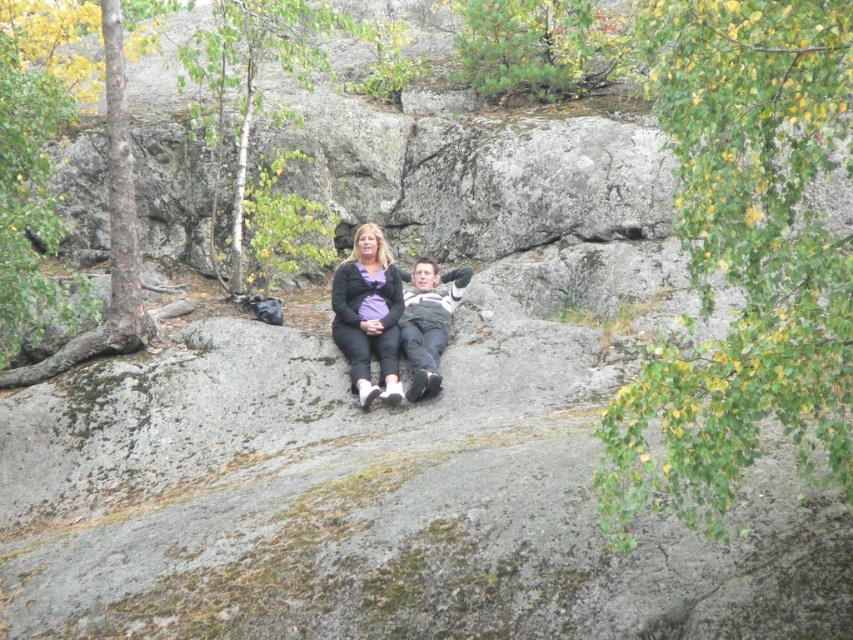
Question: Does green leafy tree at upper center have a smaller size compared to matte gray sweater at center?

Choices:
 (A) yes
 (B) no

Answer: (B)

Question: Among these objects, which one is farthest from the camera?

Choices:
 (A) green leafy branch at upper right
 (B) green rough bark tree at left
 (C) green leafy tree at upper center

Answer: (C)

Question: Estimate the real-world distances between objects in this image. Which object is closer to the matte gray sweater at center?

Choices:
 (A) matte black sweater at center
 (B) green leafy tree at upper center

Answer: (A)

Question: Does green leafy branch at upper right have a smaller size compared to green leafy tree at upper center?

Choices:
 (A) yes
 (B) no

Answer: (B)

Question: Does green leafy branch at upper right have a smaller size compared to matte black sweater at center?

Choices:
 (A) no
 (B) yes

Answer: (A)

Question: Estimate the real-world distances between objects in this image. Which object is farther from the green rough bark tree at left?

Choices:
 (A) matte gray sweater at center
 (B) green leafy tree at upper center
 (C) green leafy branch at upper right

Answer: (C)